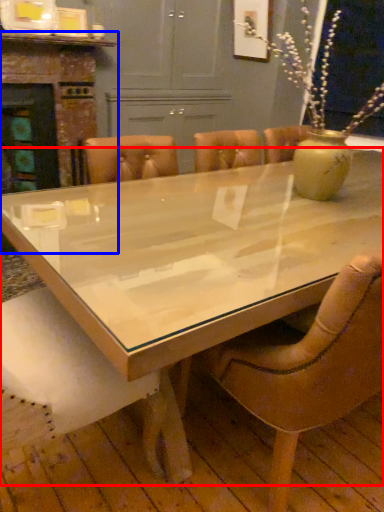
Question: Which object appears farthest to the camera in this image, coffee table (highlighted by a red box) or fireplace (highlighted by a blue box)?

Choices:
 (A) coffee table
 (B) fireplace

Answer: (B)